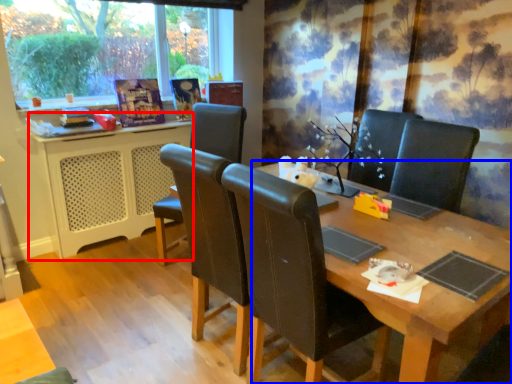
Question: Which point is further to the camera, computer desk (highlighted by a red box) or table (highlighted by a blue box)?

Choices:
 (A) computer desk
 (B) table

Answer: (A)